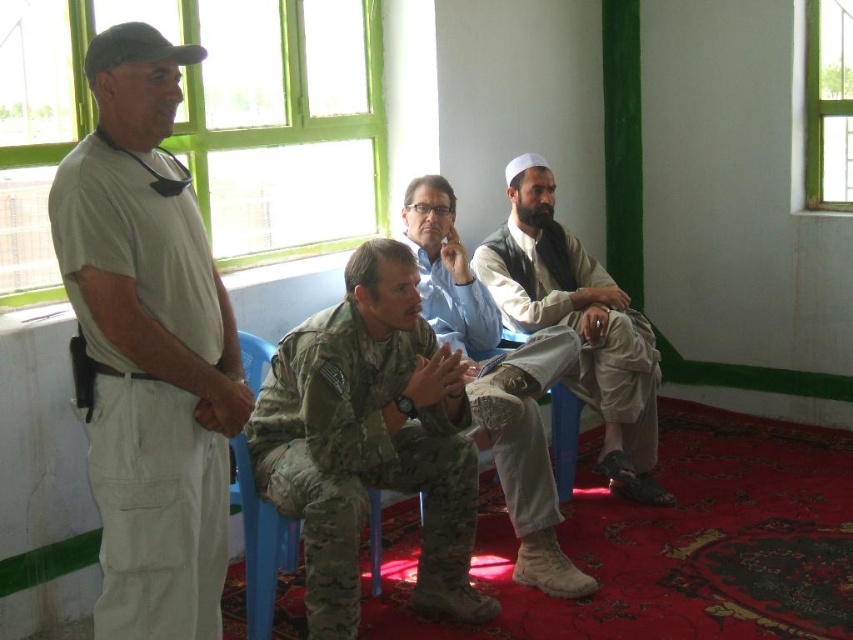
Question: Is camouflage fabric uniform at center bigger than camouflage uniform pants at center?

Choices:
 (A) yes
 (B) no

Answer: (B)

Question: Which point appears closest to the camera in this image?

Choices:
 (A) (418, 269)
 (B) (321, 529)
 (C) (519, 237)
 (D) (152, 410)

Answer: (D)

Question: Does beige fabric vest at center appear on the right side of camouflage uniform pants at center?

Choices:
 (A) yes
 (B) no

Answer: (A)

Question: Among these points, which one is nearest to the camera?

Choices:
 (A) (128, 112)
 (B) (408, 228)

Answer: (A)

Question: Estimate the real-world distances between objects in this image. Which object is farther from the camouflage uniform pants at center?

Choices:
 (A) camouflage fabric uniform at center
 (B) beige fabric vest at center

Answer: (A)

Question: Does matte khaki uniform at left appear on the left side of beige fabric vest at center?

Choices:
 (A) yes
 (B) no

Answer: (A)